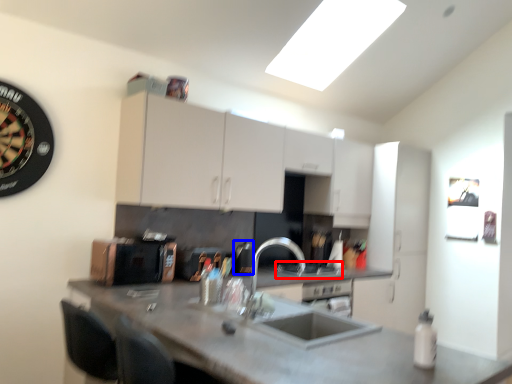
Question: Which object appears closest to the camera in this image, gas stove (highlighted by a red box) or appliance (highlighted by a blue box)?

Choices:
 (A) gas stove
 (B) appliance

Answer: (B)